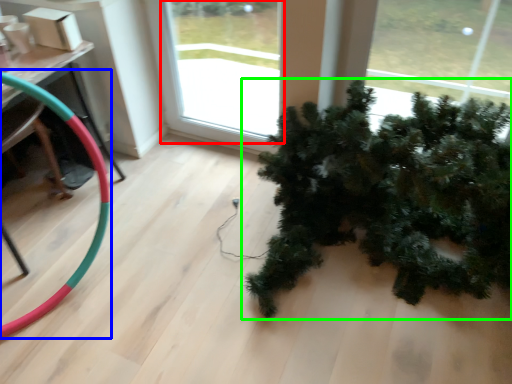
Question: Which is nearer to the window (highlighted by a red box)? garden hose (highlighted by a blue box) or houseplant (highlighted by a green box).

Choices:
 (A) garden hose
 (B) houseplant

Answer: (B)